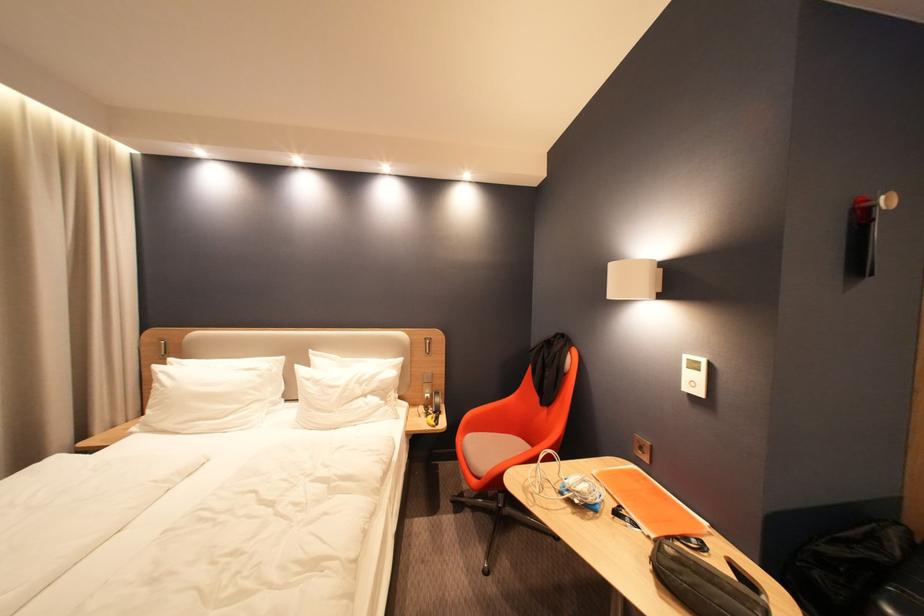
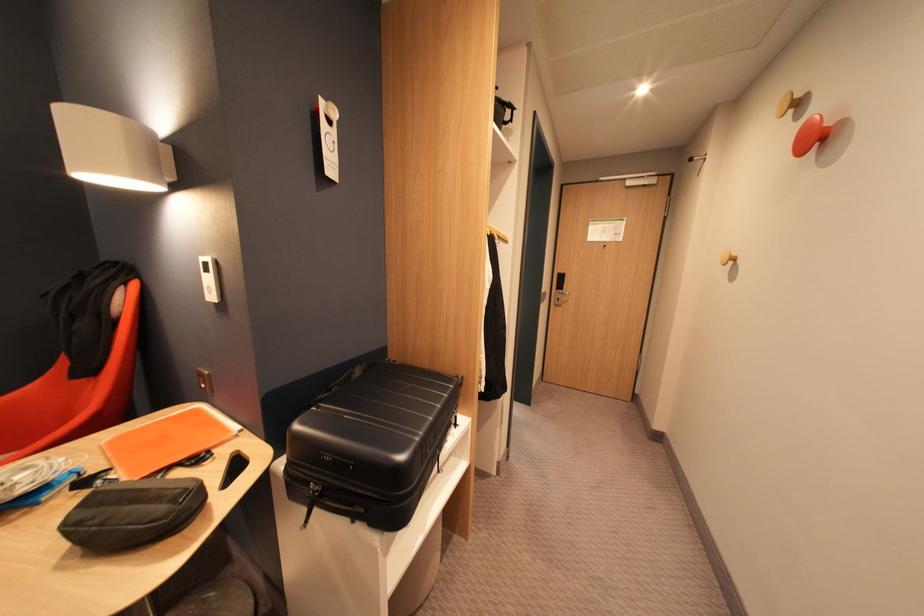
Question: Based on the continuous images, in which direction is the camera rotating? Reply with the corresponding letter.

Choices:
 (A) Left
 (B) Right
 (C) Up
 (D) Down

Answer: (B)